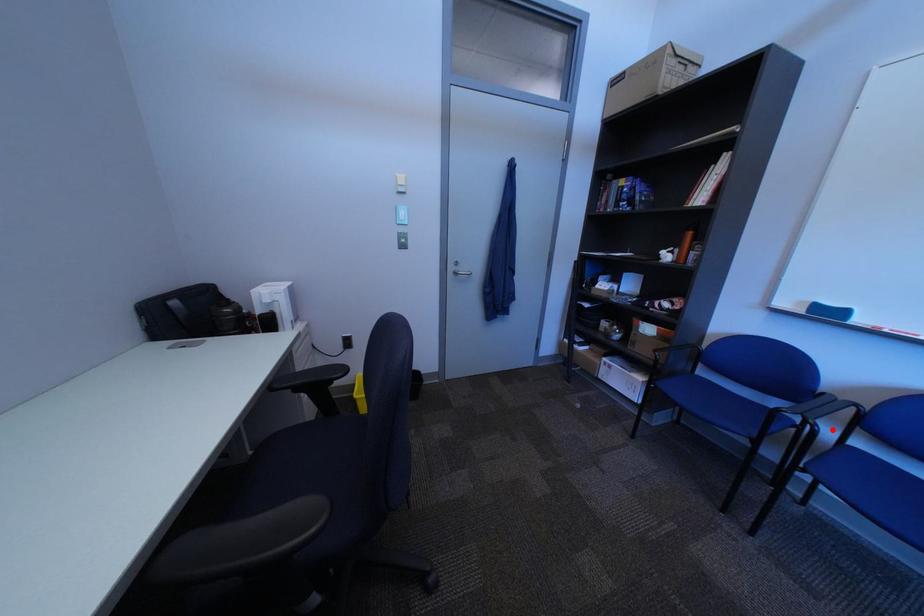
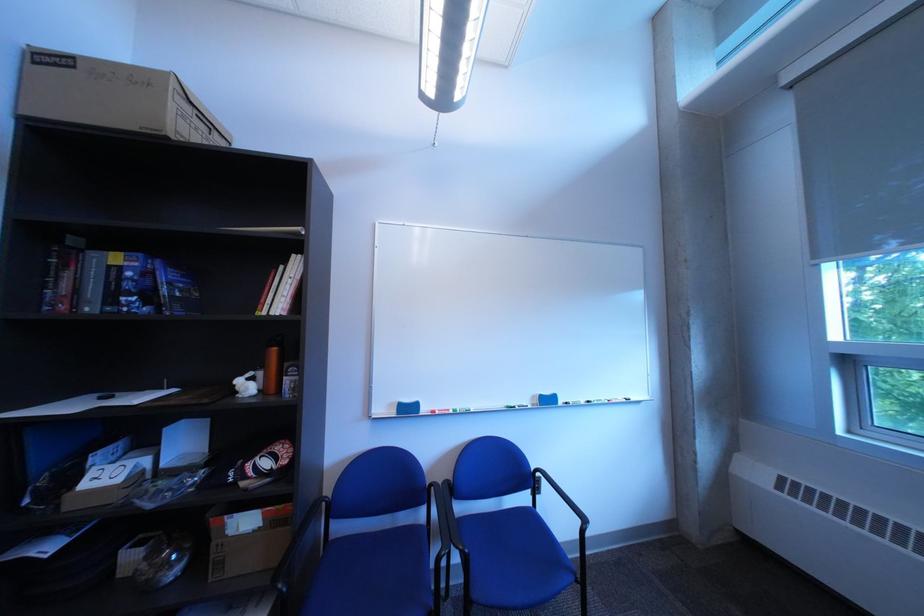
Question: I am providing you with two images of the same scene from different viewpoints. In image1, a red point is highlighted. Considering the same 3D point in image2, which of the following is correct?

Choices:
 (A) It is closer
 (B) It is farther

Answer: (A)